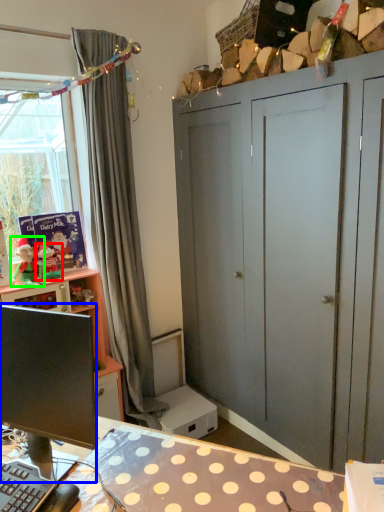
Question: Which object is positioned farthest from toy (highlighted by a red box)? Select from computer monitor (highlighted by a blue box) and person (highlighted by a green box).

Choices:
 (A) computer monitor
 (B) person

Answer: (A)